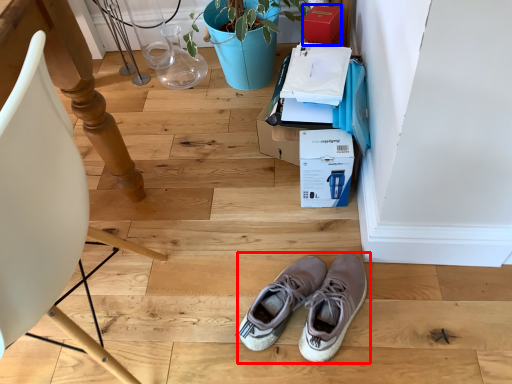
Question: Which object appears closest to the camera in this image, footwear (highlighted by a red box) or cardboard box (highlighted by a blue box)?

Choices:
 (A) footwear
 (B) cardboard box

Answer: (A)